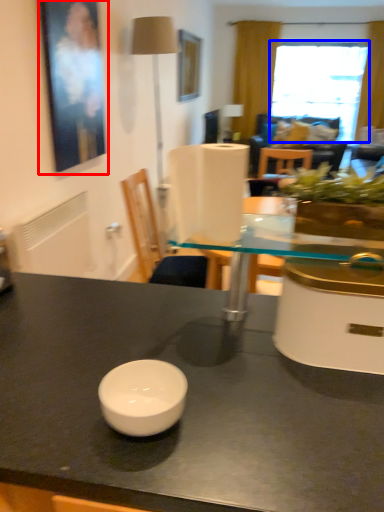
Question: Which object appears farthest to the camera in this image, picture frame (highlighted by a red box) or window (highlighted by a blue box)?

Choices:
 (A) picture frame
 (B) window

Answer: (B)